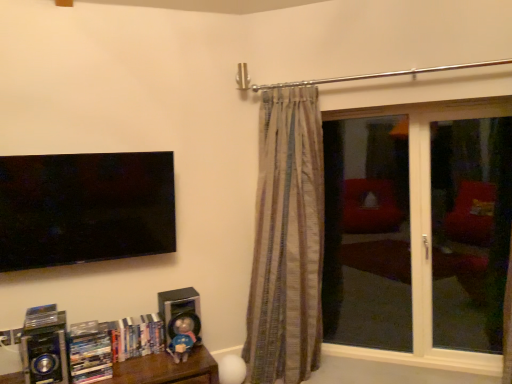
In order to face silver metallic speaker at lower center, acting as the 1th speaker starting from the right, should I rotate leftwards or rightwards?

Turn left by 9.943 degrees to look at silver metallic speaker at lower center, acting as the 1th speaker starting from the right.

Measure the distance between transparent glass screen door at right, which is the 2th screen door from right to left, and camera.

They are 2.83 meters apart.

Measure the distance between point (x=407, y=126) and camera.

They are 8.97 feet apart.

The width and height of the screenshot is (512, 384). What do you see at coordinates (45, 356) in the screenshot? I see `metallic blue speaker at lower left, arranged as the 2th speaker when viewed from the back` at bounding box center [45, 356].

Locate an element on the screen. Image resolution: width=512 pixels, height=384 pixels. matte plastic books at lower left is located at coordinates (90, 357).

Find the location of a particular element. metallic silver stereo at lower left is located at coordinates (167, 369).

Between point (34, 349) and point (429, 289), which one is positioned in front?

The point (34, 349) is closer.

Is metallic blue speaker at lower left, which appears as the first speaker when viewed from the left, oriented away from transparent glass window at right?

No.

Between metallic blue speaker at lower left, arranged as the 2th speaker when viewed from the back, and transparent glass window at right, which one is positioned behind?

transparent glass window at right is further from the camera.

Are metallic blue speaker at lower left, which is the 1th speaker from front to back, and transparent glass window at right far apart?

Yes.

From the image's perspective, which is below, matte blue plush at lower center or transparent glass screen door at right, acting as the 2th screen door starting from the left?

matte blue plush at lower center.

How many degrees apart are the facing directions of matte blue plush at lower center and transparent glass screen door at right, which ranks as the 1th screen door in right-to-left order?

The facing directions of matte blue plush at lower center and transparent glass screen door at right, which ranks as the 1th screen door in right-to-left order, are 47.8 degrees apart.

From a real-world perspective, is matte blue plush at lower center positioned above or below transparent glass screen door at right, which ranks as the 1th screen door in right-to-left order?

matte blue plush at lower center is below transparent glass screen door at right, which ranks as the 1th screen door in right-to-left order.

Which of these two, matte blue plush at lower center or transparent glass screen door at right, which ranks as the 1th screen door in right-to-left order, is thinner?

Thinner between the two is matte blue plush at lower center.

Which is correct: metallic blue speaker at lower left, which is the 2th speaker from right to left, is inside transparent glass screen door at right, which is the 2th screen door from right to left, or outside of it?

metallic blue speaker at lower left, which is the 2th speaker from right to left, cannot be found inside transparent glass screen door at right, which is the 2th screen door from right to left.

Considering the relative positions of metallic blue speaker at lower left, which appears as the first speaker when viewed from the left, and transparent glass screen door at right, the 1th screen door when ordered from left to right, in the image provided, is metallic blue speaker at lower left, which appears as the first speaker when viewed from the left, to the right of transparent glass screen door at right, the 1th screen door when ordered from left to right, from the viewer's perspective?

In fact, metallic blue speaker at lower left, which appears as the first speaker when viewed from the left, is to the left of transparent glass screen door at right, the 1th screen door when ordered from left to right.

Based on the photo, how much distance is there between metallic blue speaker at lower left, arranged as the 2th speaker when viewed from the back, and transparent glass screen door at right, the 1th screen door when ordered from left to right?

metallic blue speaker at lower left, arranged as the 2th speaker when viewed from the back, and transparent glass screen door at right, the 1th screen door when ordered from left to right, are 2.44 meters apart.

From the image's perspective, which one is positioned lower, metallic blue speaker at lower left, which appears as the first speaker when viewed from the left, or transparent glass screen door at right, the 1th screen door when ordered from left to right?

metallic blue speaker at lower left, which appears as the first speaker when viewed from the left, is shown below in the image.

Between silver metallic speaker at lower center, which is the 2th speaker from front to back, and metallic blue speaker at lower left, which is the 2th speaker from right to left, which one has larger size?

metallic blue speaker at lower left, which is the 2th speaker from right to left.

Which of these two, silver metallic speaker at lower center, acting as the 1th speaker starting from the right, or metallic blue speaker at lower left, which appears as the first speaker when viewed from the left, stands shorter?

Standing shorter between the two is metallic blue speaker at lower left, which appears as the first speaker when viewed from the left.

Which is less distant, (x=183, y=289) or (x=60, y=380)?

Point (x=183, y=289) is positioned farther from the camera compared to point (x=60, y=380).

How different are the orientations of metallic blue speaker at lower left, arranged as the 2th speaker when viewed from the back, and matte blue plush at lower center in degrees?

The angular difference between metallic blue speaker at lower left, arranged as the 2th speaker when viewed from the back, and matte blue plush at lower center is 3.55 degrees.

How much distance is there between metallic blue speaker at lower left, arranged as the 2th speaker when viewed from the back, and matte blue plush at lower center?

A distance of 24.09 inches exists between metallic blue speaker at lower left, arranged as the 2th speaker when viewed from the back, and matte blue plush at lower center.

Is point (44, 358) farther from camera compared to point (194, 334)?

No, it is in front of (194, 334).

Considering the relative positions of metallic blue speaker at lower left, which appears as the first speaker when viewed from the left, and matte blue plush at lower center in the image provided, is metallic blue speaker at lower left, which appears as the first speaker when viewed from the left, to the right of matte blue plush at lower center from the viewer's perspective?

No.

Can you tell me how much matte blue plush at lower center and transparent glass window at right differ in facing direction?

The angular difference between matte blue plush at lower center and transparent glass window at right is 47.8 degrees.

Can you confirm if matte blue plush at lower center is positioned to the left of transparent glass window at right?

Yes.

Is matte blue plush at lower center not inside transparent glass window at right?

Absolutely, matte blue plush at lower center is external to transparent glass window at right.

Image resolution: width=512 pixels, height=384 pixels. I want to click on toy lying in front of the transparent glass window at right, so click(x=182, y=339).

Would you say transparent glass screen door at right, which ranks as the 1th screen door in right-to-left order, is outside matte plastic books at lower left?

Indeed, transparent glass screen door at right, which ranks as the 1th screen door in right-to-left order, is completely outside matte plastic books at lower left.

Which point is more distant from viewer, (x=478, y=256) or (x=100, y=360)?

Point (x=478, y=256)

In the image, is transparent glass screen door at right, which ranks as the 1th screen door in right-to-left order, positioned in front of or behind matte plastic books at lower left?

Clearly, transparent glass screen door at right, which ranks as the 1th screen door in right-to-left order, is behind matte plastic books at lower left.

Image resolution: width=512 pixels, height=384 pixels. Identify the location of the 2nd speaker below the transparent glass window at right (from a real-world perspective). (45, 356).

Where is `toy in front of the transparent glass screen door at right, acting as the 2th screen door starting from the left`? Image resolution: width=512 pixels, height=384 pixels. toy in front of the transparent glass screen door at right, acting as the 2th screen door starting from the left is located at coordinates (182, 339).

Based on their spatial positions, is metallic blue speaker at lower left, which is the 2th speaker from right to left, or matte plastic books at lower left further from transparent glass window at right?

Based on the image, metallic blue speaker at lower left, which is the 2th speaker from right to left, appears to be further to transparent glass window at right.

When comparing their distances from matte blue plush at lower center, does transparent glass screen door at right, which ranks as the 1th screen door in right-to-left order, or metallic blue speaker at lower left, arranged as the 2th speaker when viewed from the back, seem closer?

metallic blue speaker at lower left, arranged as the 2th speaker when viewed from the back.

Considering their positions, is transparent glass screen door at right, which ranks as the 1th screen door in right-to-left order, positioned further to striped fabric curtain at center than metallic silver stereo at lower left?

transparent glass screen door at right, which ranks as the 1th screen door in right-to-left order, lies further to striped fabric curtain at center than the other object.

Based on their spatial positions, is matte plastic books at lower left or metallic blue speaker at lower left, which is the 1th speaker from front to back, closer to transparent glass screen door at right, which is the 2th screen door from right to left?

matte plastic books at lower left lies closer to transparent glass screen door at right, which is the 2th screen door from right to left, than the other object.

Based on the photo, looking at the image, which one is located further to metallic silver stereo at lower left, metallic blue speaker at lower left, arranged as the 2th speaker when viewed from the back, or transparent glass window at right?

The object further to metallic silver stereo at lower left is transparent glass window at right.

Based on their spatial positions, is transparent glass screen door at right, the 1th screen door when ordered from left to right, or silver metallic speaker at lower center, the 2th speaker in the left-to-right sequence, further from metallic blue speaker at lower left, arranged as the 2th speaker when viewed from the back?

Among the two, transparent glass screen door at right, the 1th screen door when ordered from left to right, is located further to metallic blue speaker at lower left, arranged as the 2th speaker when viewed from the back.

From the image, which object appears to be nearer to matte blue plush at lower center, metallic blue speaker at lower left, which appears as the first speaker when viewed from the left, or silver metallic speaker at lower center, which is the 1th speaker in back-to-front order?

Among the two, silver metallic speaker at lower center, which is the 1th speaker in back-to-front order, is located nearer to matte blue plush at lower center.

From the picture: Looking at the image, which one is located further to silver metallic speaker at lower center, the 2th speaker in the left-to-right sequence, transparent glass screen door at right, acting as the 2th screen door starting from the left, or transparent glass window at right?

transparent glass screen door at right, acting as the 2th screen door starting from the left, is positioned further to the anchor silver metallic speaker at lower center, the 2th speaker in the left-to-right sequence.

This screenshot has width=512, height=384. Identify the location of toy located between silver metallic speaker at lower center, the 2th speaker in the left-to-right sequence, and transparent glass screen door at right, which ranks as the 1th screen door in right-to-left order, in the left-right direction. (182, 339).

Find the location of a particular element. This screenshot has height=384, width=512. toy between matte plastic books at lower left and striped fabric curtain at center in the horizontal direction is located at coordinates (182, 339).

Find the location of a particular element. The image size is (512, 384). window between matte plastic books at lower left and transparent glass screen door at right, which ranks as the 1th screen door in right-to-left order is located at coordinates [x=425, y=230].

The width and height of the screenshot is (512, 384). What are the coordinates of `curtain between metallic silver stereo at lower left and transparent glass window at right` in the screenshot? It's located at (287, 241).